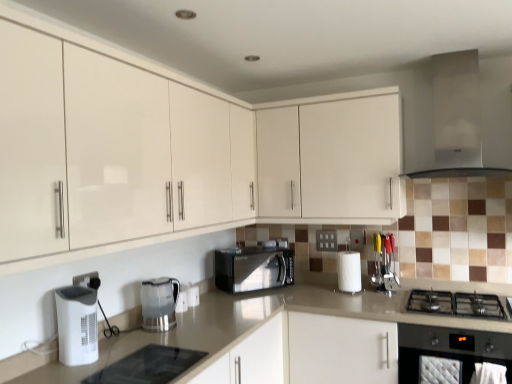
Question: Considering the positions of satin silver exhaust hood at upper right and beige laminate countertop at center in the image, is satin silver exhaust hood at upper right bigger or smaller than beige laminate countertop at center?

Choices:
 (A) small
 (B) big

Answer: (A)

Question: Is satin silver exhaust hood at upper right in front of or behind beige laminate countertop at center in the image?

Choices:
 (A) front
 (B) behind

Answer: (B)

Question: Considering the real-world distances, which object is closest to the black matte gas stove at lower right?

Choices:
 (A) black matte microwave at center
 (B) black matte gas stove at lower right
 (C) white glossy cabinet at upper center, placed as the second cabinetry when sorted from front to back
 (D) white plastic electric outlet at center, which is counted as the 2th electric outlet, starting from the left
 (E) satin silver exhaust hood at upper right

Answer: (B)

Question: Based on their relative distances, which object is nearer to the white plastic air purifier at lower left, arranged as the first kitchen appliance when viewed from the left?

Choices:
 (A) white glossy cabinet at upper center, placed as the second cabinetry when sorted from front to back
 (B) white plastic electric outlet at lower center, placed as the second electric outlet when sorted from right to left
 (C) black glass cooktop at lower center, marked as the second appliance in a right-to-left arrangement
 (D) black matte gas stove at lower right
 (E) clear plastic kettle at center, which is counted as the 2th kitchen appliance, starting from the front

Answer: (B)